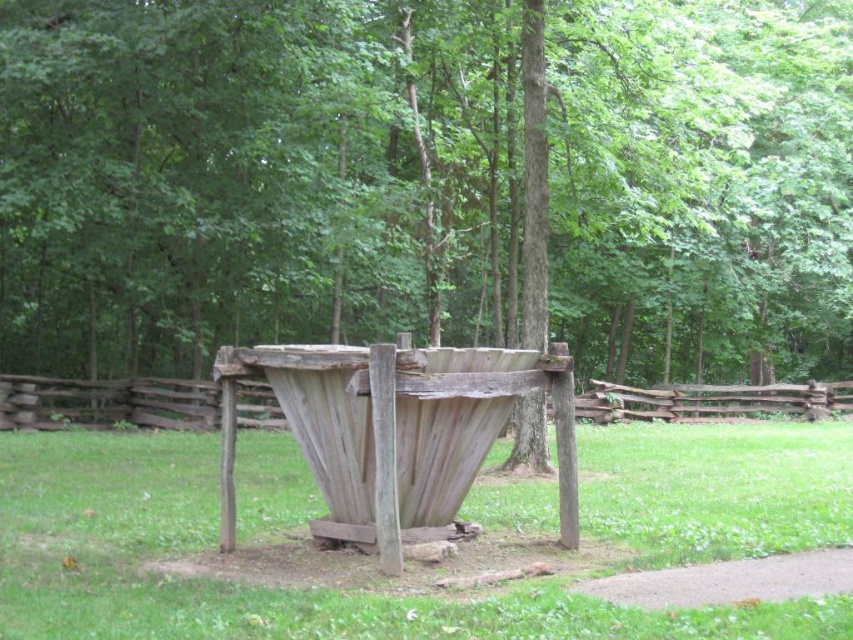
Who is more forward, (181, 317) or (618, 417)?

Positioned in front is point (181, 317).

Consider the image. Is smooth brown tree trunk at center bigger than weathered wood fence at center?

Correct, smooth brown tree trunk at center is larger in size than weathered wood fence at center.

Who is more distant from viewer, (x=218, y=12) or (x=99, y=419)?

The point (x=99, y=419) is behind.

Where is `smooth brown tree trunk at center`? The image size is (853, 640). smooth brown tree trunk at center is located at coordinates (251, 176).

Measure the distance between smooth brown tree trunk at center and green grass at center.

smooth brown tree trunk at center is 7.80 meters away from green grass at center.

The width and height of the screenshot is (853, 640). I want to click on smooth brown tree trunk at center, so click(x=251, y=176).

Is point (113, 68) less distant than point (10, 618)?

No, it is behind (10, 618).

You are a GUI agent. You are given a task and a screenshot of the screen. Output one action in this format:
    pyautogui.click(x=<x>, y=<y>)
    Task: Click on the smooth brown tree trunk at center
    The width and height of the screenshot is (853, 640).
    Given the screenshot: What is the action you would take?
    pyautogui.click(x=251, y=176)

From the picture: Does green grass at center appear on the right side of weathered wood fence at center?

No, green grass at center is not to the right of weathered wood fence at center.

Is green grass at center further to the viewer compared to weathered wood fence at center?

No, it is in front of weathered wood fence at center.

Where is `green grass at center`? green grass at center is located at coordinates click(259, 588).